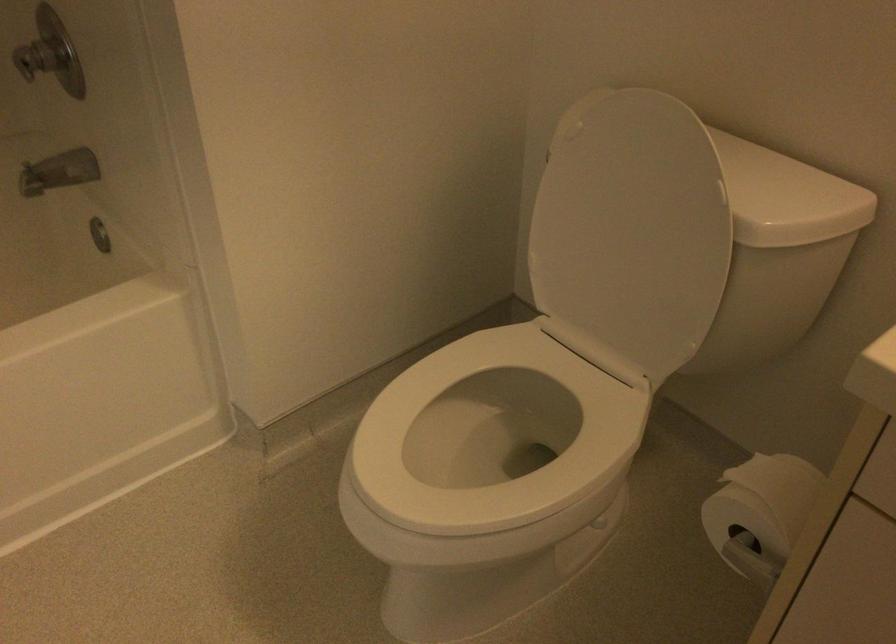
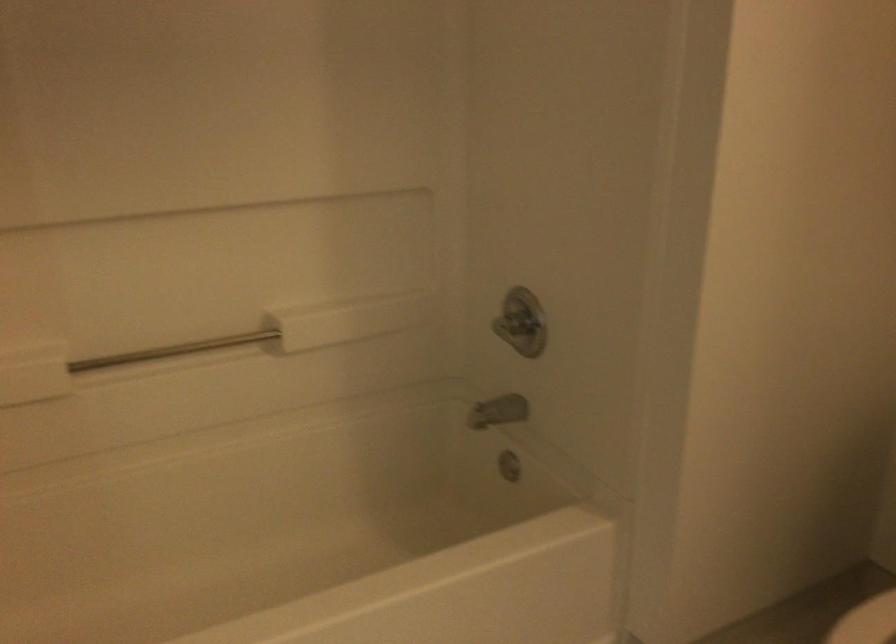
Question: The images are taken continuously from a first-person perspective. In which direction is your viewpoint rotating?

Choices:
 (A) Left
 (B) Right
 (C) Up
 (D) Down

Answer: (C)